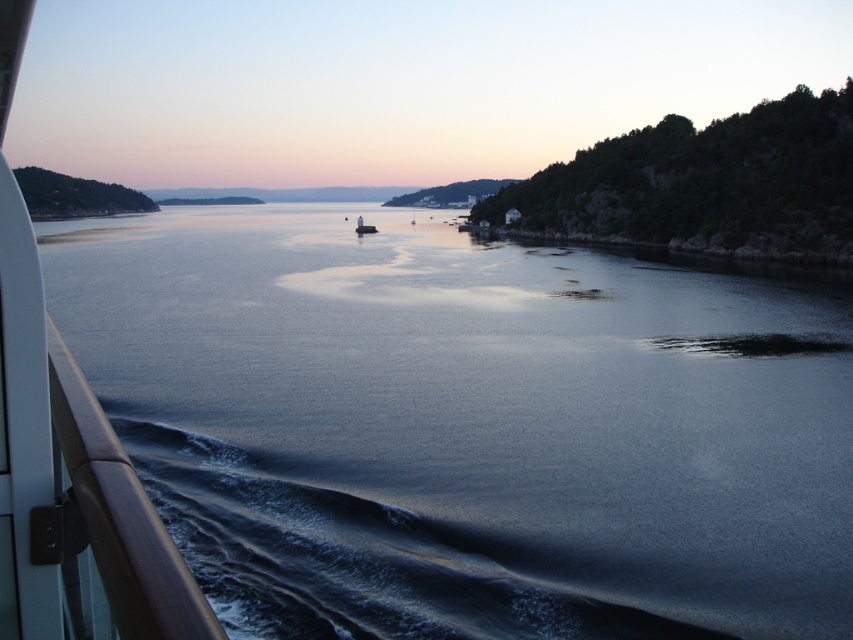
Who is higher up, glossy water at center or white glossy lighthouse at center?

white glossy lighthouse at center is higher up.

Between point (160, 272) and point (358, 228), which one is positioned behind?

The point (358, 228) is more distant.

Who is more forward, (x=402, y=403) or (x=360, y=225)?

Point (x=402, y=403)

The image size is (853, 640). What are the coordinates of `glossy water at center` in the screenshot? It's located at (469, 426).

Between point (160, 248) and point (3, 224), which one is positioned behind?

Point (160, 248)

Who is positioned more to the left, glossy water at center or brown polished wood boat at left?

From the viewer's perspective, glossy water at center appears more on the left side.

This screenshot has height=640, width=853. Describe the element at coordinates (469, 426) in the screenshot. I see `glossy water at center` at that location.

Identify the location of glossy water at center. (469, 426).

Which of these two, brown polished wood boat at left or white glossy lighthouse at center, stands shorter?

With less height is brown polished wood boat at left.

At what (x,y) coordinates should I click in order to perform the action: click on brown polished wood boat at left. Please return your answer as a coordinate pair (x, y). This screenshot has width=853, height=640. Looking at the image, I should click on (68, 461).